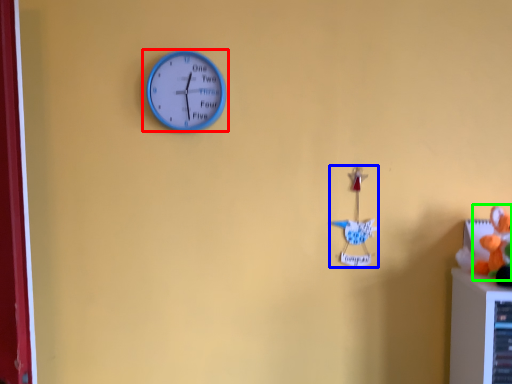
Question: Based on their relative distances, which object is farther from wall clock (highlighted by a red box)? Choose from toy (highlighted by a blue box) and toy (highlighted by a green box).

Choices:
 (A) toy
 (B) toy

Answer: (B)